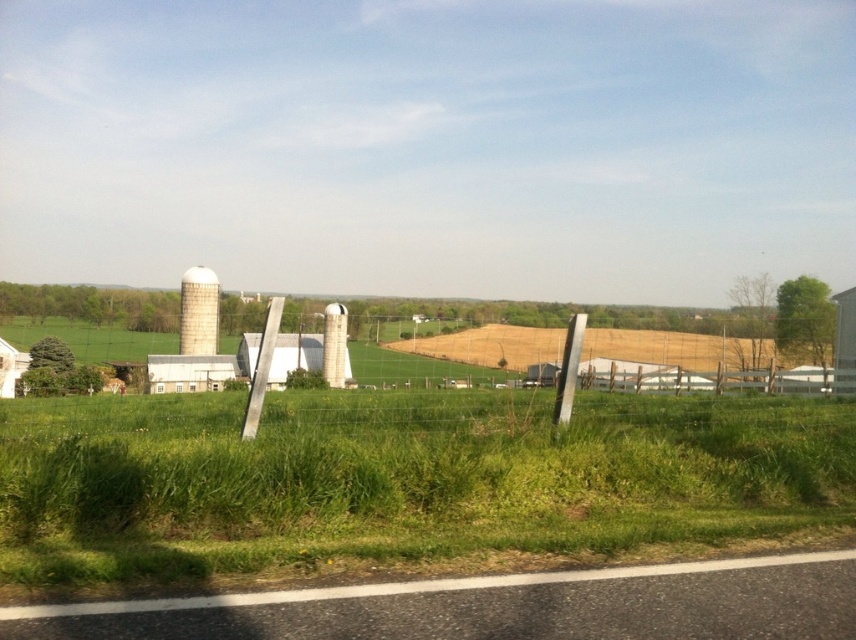
Between green grass at lower center and white matte silo at center, which one appears on the left side from the viewer's perspective?

Positioned to the left is white matte silo at center.

Is green grass at lower center above white matte silo at center?

Yes.

Who is more distant from viewer, (36, 477) or (325, 346)?

The point (325, 346) is more distant.

At what (x,y) coordinates should I click in order to perform the action: click on green grass at lower center. Please return your answer as a coordinate pair (x, y). The image size is (856, 640). Looking at the image, I should click on (403, 481).

Does green grass at lower center have a lesser height compared to white matte silo at upper left?

Indeed, green grass at lower center has a lesser height compared to white matte silo at upper left.

Is green grass at lower center positioned before white matte silo at upper left?

Yes, green grass at lower center is closer to the viewer.

What do you see at coordinates (403, 481) in the screenshot?
I see `green grass at lower center` at bounding box center [403, 481].

Locate an element on the screen. Image resolution: width=856 pixels, height=640 pixels. green grass at lower center is located at coordinates (403, 481).

Who is shorter, white matte silo at upper left or white matte silo at center?

Standing shorter between the two is white matte silo at center.

Who is lower down, white matte silo at upper left or white matte silo at center?

white matte silo at center

At what (x,y) coordinates should I click in order to perform the action: click on white matte silo at upper left. Please return your answer as a coordinate pair (x, y). This screenshot has height=640, width=856. Looking at the image, I should click on (198, 310).

Locate an element on the screen. white matte silo at upper left is located at coordinates (198, 310).